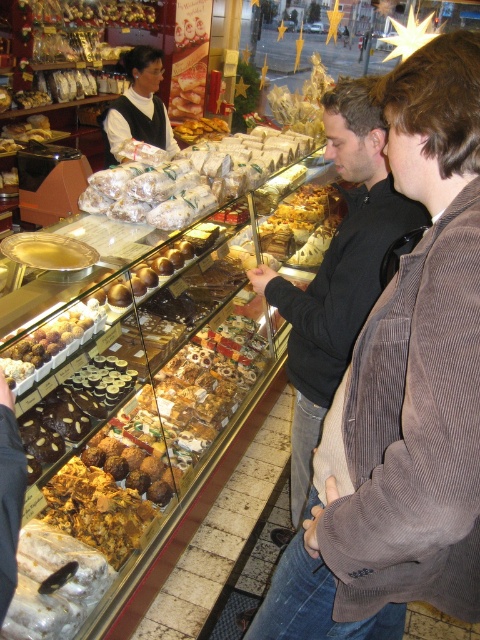
You are a customer at the bakery and see the black corduroy jacket at center and the white paper wrapped pastries at center. Which item is positioned to the right of the other?

The black corduroy jacket at center is to the right of the white paper wrapped pastries at center.

You are a customer in the bakery and want to buy both the white paper wrapped pastries at center and the matte black vest at center. However, your bag can only hold one item at a time. Based on their sizes, which item should you pick first to ensure it fits in your bag?

The white paper wrapped pastries at center is bigger than the matte black vest at center, so you should pick the white paper wrapped pastries at center first to ensure it fits in your bag before the smaller matte black vest at center.

You are a customer in the bakery and want to place your black corduroy jacket at center on top of the white paper wrapped pastries at center. Will the jacket fit without hanging over the edge?

The black corduroy jacket at center has a smaller size compared to white paper wrapped pastries at center, so it will fit without hanging over the edge.